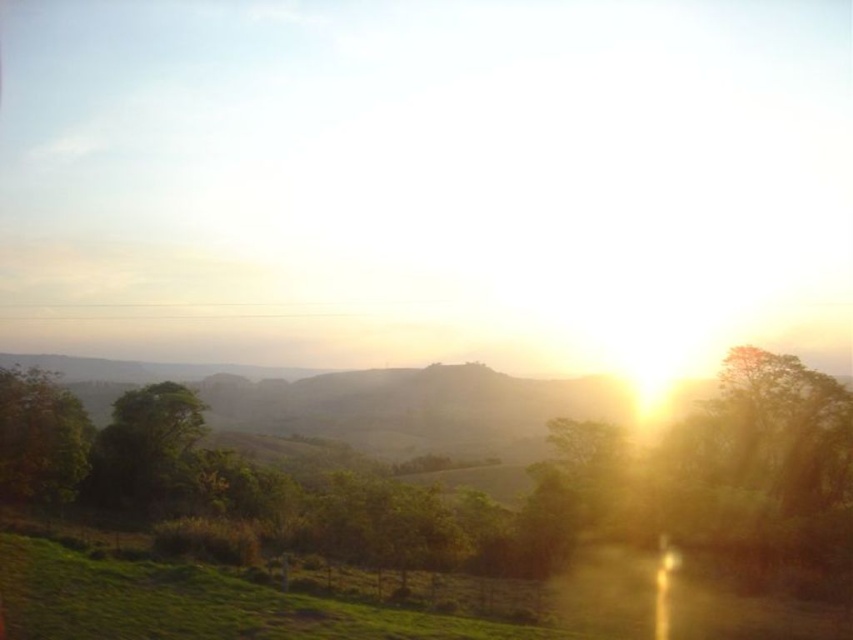
You are a bird looking for a higher perch. You see a green leafy tree at left and a green matte tree at left. Which tree should you choose to get a higher vantage point?

The green leafy tree at left is much taller than the green matte tree at left, so you should choose the green leafy tree at left for a higher vantage point.

You are standing in the middle of the green field and want to walk towards both the green leafy tree at left and the green matte tree at left. Which tree will you reach first?

You will reach the green leafy tree at left first because it is closer to you than the green matte tree at left.